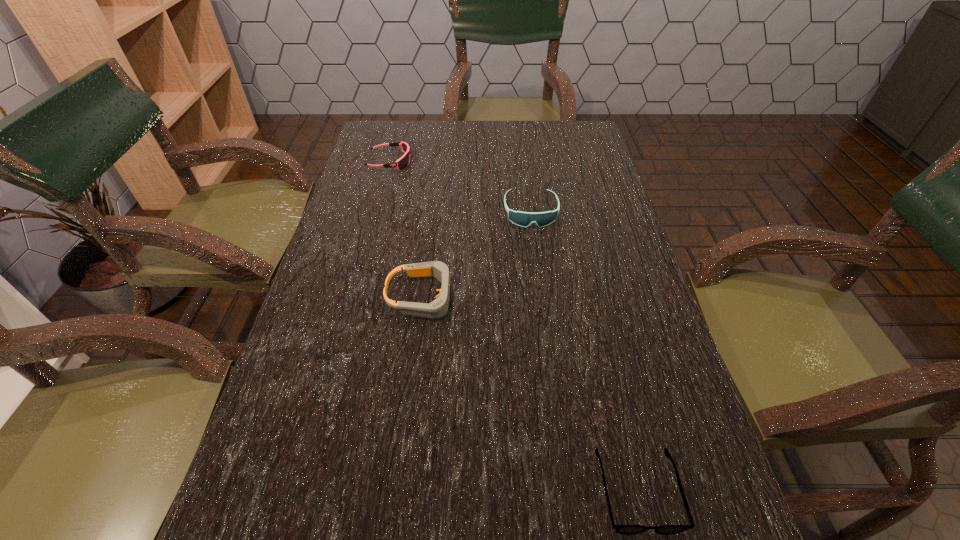
Where is `object identified as the second closest to the farthest goggles`? object identified as the second closest to the farthest goggles is located at coordinates (438, 308).

Locate which goggles is the closest to the nearest goggles. Please provide its 2D coordinates. Your answer should be formatted as a tuple, i.e. [(x, y)], where the tuple contains the x and y coordinates of a point satisfying the conditions above.

[(524, 219)]

At what (x,y) coordinates should I click in order to perform the action: click on goggles that is the closest to the nearest object. Please return your answer as a coordinate pair (x, y). Image resolution: width=960 pixels, height=540 pixels. Looking at the image, I should click on (438, 308).

Locate an element on the screen. The image size is (960, 540). vacant position in the image that satisfies the following two spatial constraints: 1. on the front-facing side of the second farthest object; 2. on the front and back of the third farthest object is located at coordinates (541, 297).

At what (x,y) coordinates should I click in order to perform the action: click on blank area in the image that satisfies the following two spatial constraints: 1. on the front-facing side of the second nearest goggles; 2. on the front and back of the third farthest object. Please return your answer as a coordinate pair (x, y). The image size is (960, 540). Looking at the image, I should click on (541, 297).

Find the location of `vacant space that satisfies the following two spatial constraints: 1. on the front-facing side of the second farthest goggles; 2. on the front and back of the second object from left to right`. vacant space that satisfies the following two spatial constraints: 1. on the front-facing side of the second farthest goggles; 2. on the front and back of the second object from left to right is located at coordinates click(541, 297).

At what (x,y) coordinates should I click in order to perform the action: click on vacant point that satisfies the following two spatial constraints: 1. on the front-facing side of the second farthest goggles; 2. on the front and back of the third farthest object. Please return your answer as a coordinate pair (x, y). Image resolution: width=960 pixels, height=540 pixels. Looking at the image, I should click on (x=541, y=297).